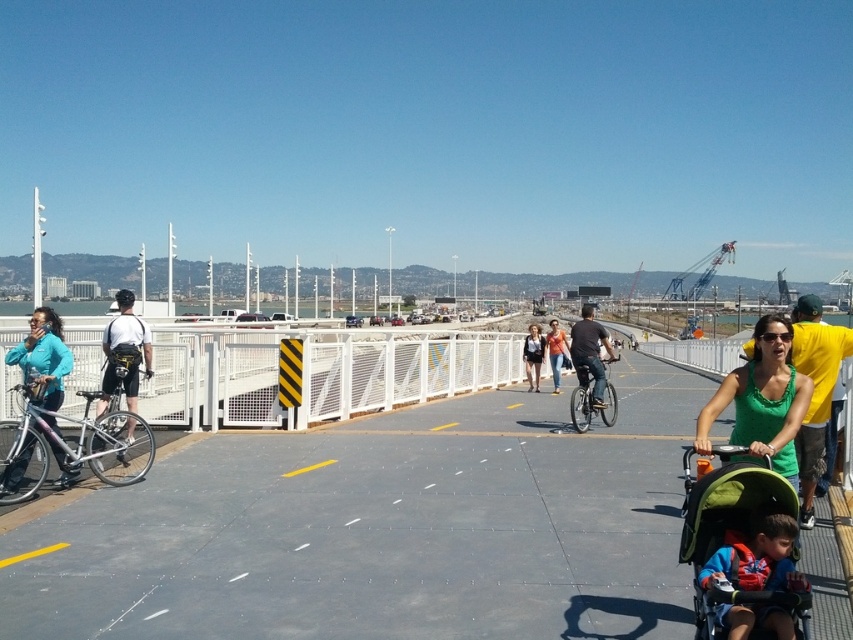
Does silver metallic bicycle at left have a greater height compared to denim jeans at center?

Incorrect, silver metallic bicycle at left's height is not larger of denim jeans at center's.

Does point (32, 396) come closer to viewer compared to point (556, 337)?

Yes.

Is point (140, 440) in front of point (567, 348)?

Yes, point (140, 440) is closer to viewer.

In order to click on silver metallic bicycle at left in this screenshot , I will do `click(68, 445)`.

Which is above, silver metallic bicycle at left or matte black bicycle at center?

Positioned higher is matte black bicycle at center.

How distant is silver metallic bicycle at left from matte black bicycle at center?

They are 21.74 feet apart.

Measure the distance between silver metallic bicycle at left and camera.

silver metallic bicycle at left is 6.59 meters away from camera.

You are a GUI agent. You are given a task and a screenshot of the screen. Output one action in this format:
    pyautogui.click(x=<x>, y=<y>)
    Task: Click on the silver metallic bicycle at left
    The width and height of the screenshot is (853, 640).
    Given the screenshot: What is the action you would take?
    pyautogui.click(x=68, y=445)

Which of these two, green matte tank top at center or matte black tank top at center, stands taller?

green matte tank top at center is taller.

Can you confirm if green matte tank top at center is positioned to the left of matte black tank top at center?

Correct, you'll find green matte tank top at center to the left of matte black tank top at center.

Which is in front, point (788, 442) or point (537, 352)?

Positioned in front is point (788, 442).

Where is `green matte tank top at center`? The image size is (853, 640). green matte tank top at center is located at coordinates (762, 401).